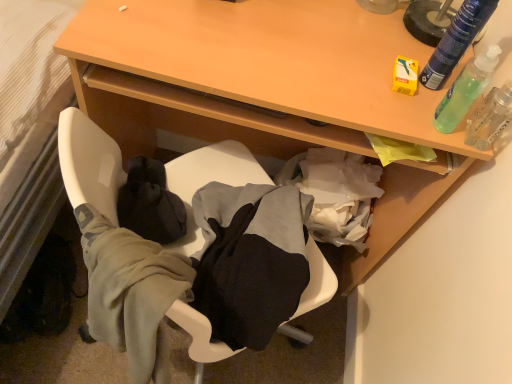
You are a GUI agent. You are given a task and a screenshot of the screen. Output one action in this format:
    pyautogui.click(x=<x>, y=<y>)
    Task: Click on the free space above wooden table at upper center (from a real-world perspective)
    
    Given the screenshot: What is the action you would take?
    pyautogui.click(x=310, y=44)